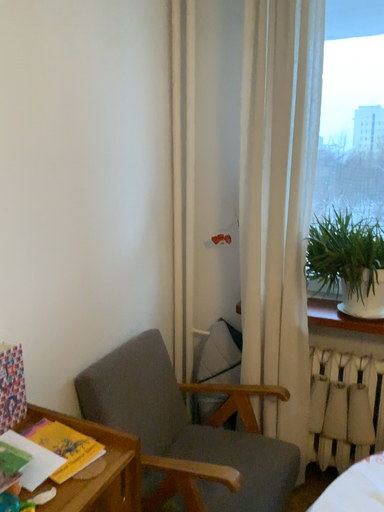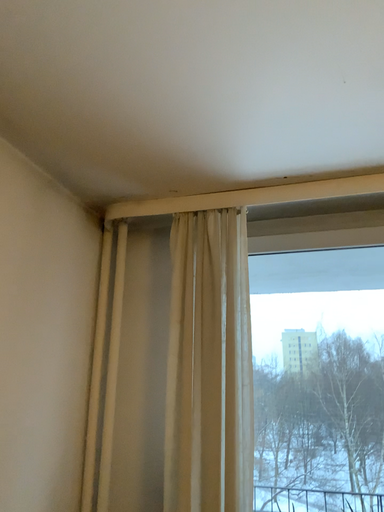
Question: Which way did the camera rotate in the video?

Choices:
 (A) rotated upward
 (B) rotated downward

Answer: (A)